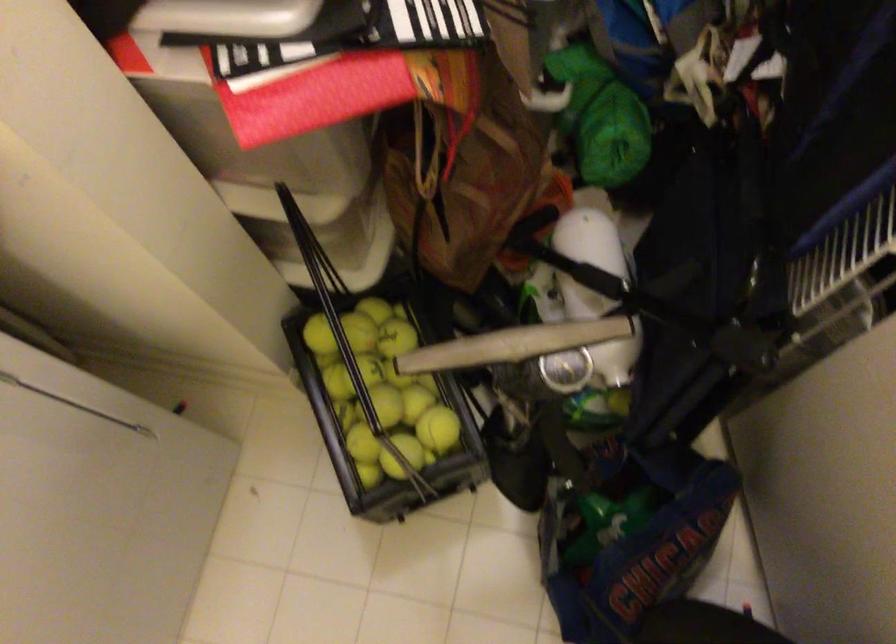
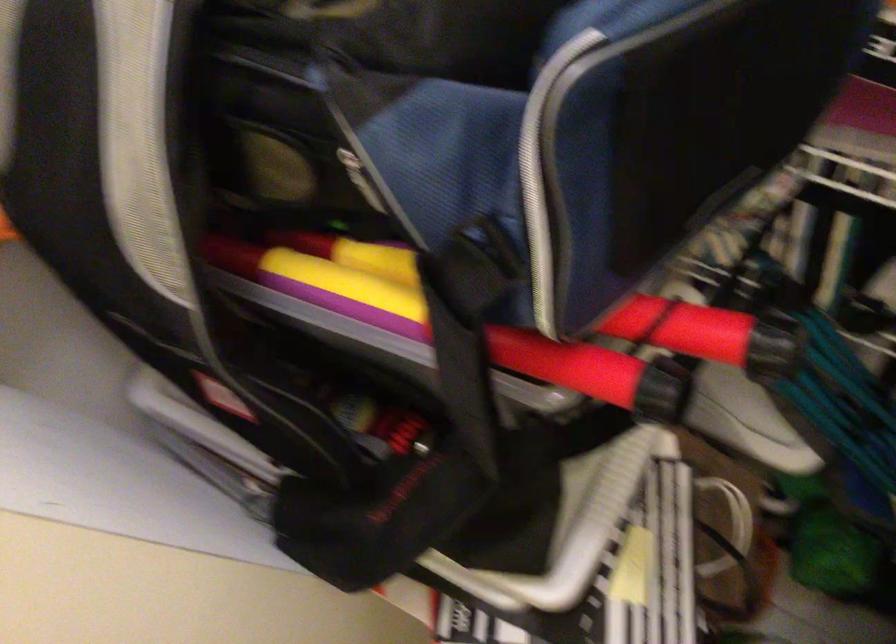
The images are taken continuously from a first-person perspective. In which direction are you moving?

The cameraman walked toward left, backward.